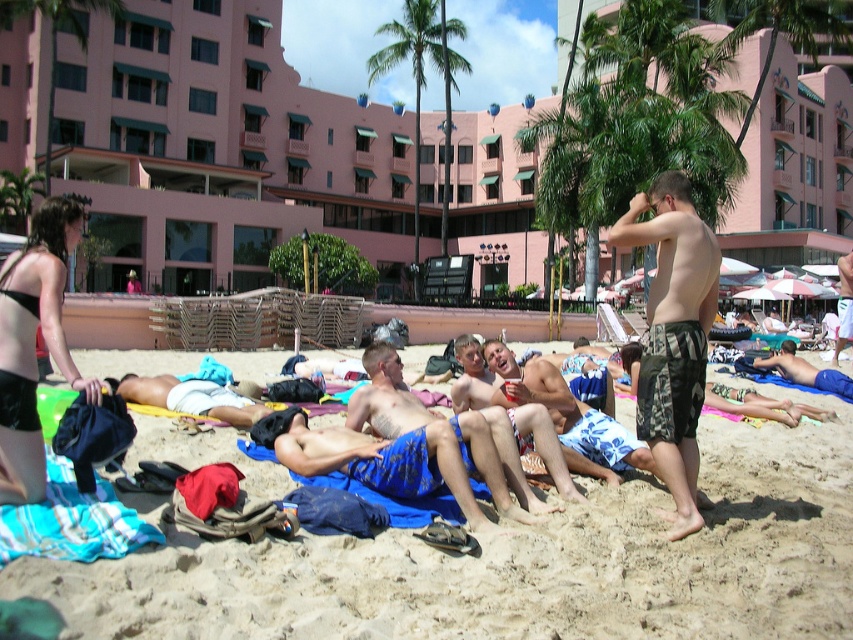
You are a photographer trying to capture a candid shot of the beach scene. You notice two people wearing shorts at the center of the image. Which pair of shorts is positioned higher in the frame, the blue floral shorts at center or the white cotton shorts at center?

The blue floral shorts at center is located above the white cotton shorts at center, so it is positioned higher in the frame.

You are a photographer trying to capture the pink concrete building at center and the blue textured shorts at center in the same frame. Based on their sizes in the image, which object would appear larger?

The pink concrete building at center would appear larger in the frame because it is much taller than the blue textured shorts at center.